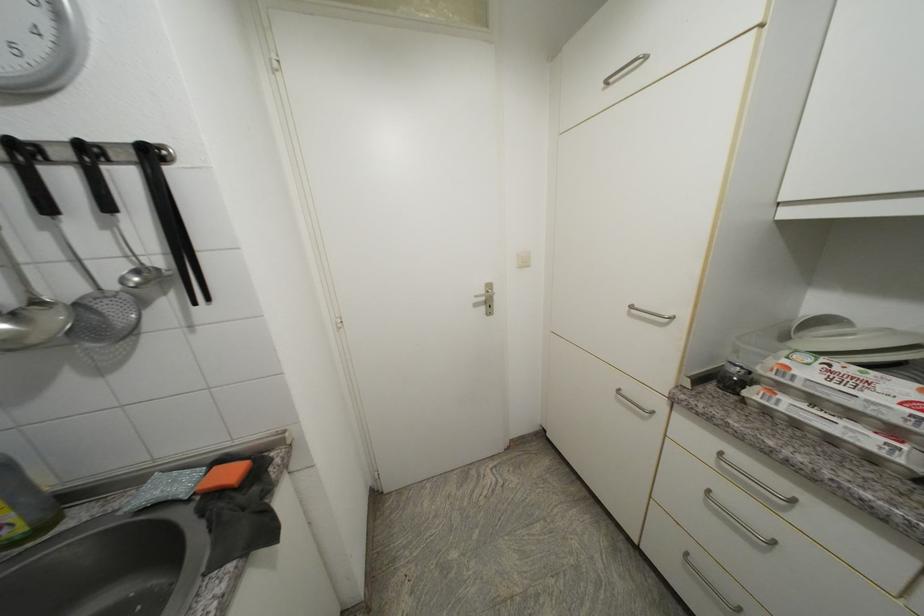
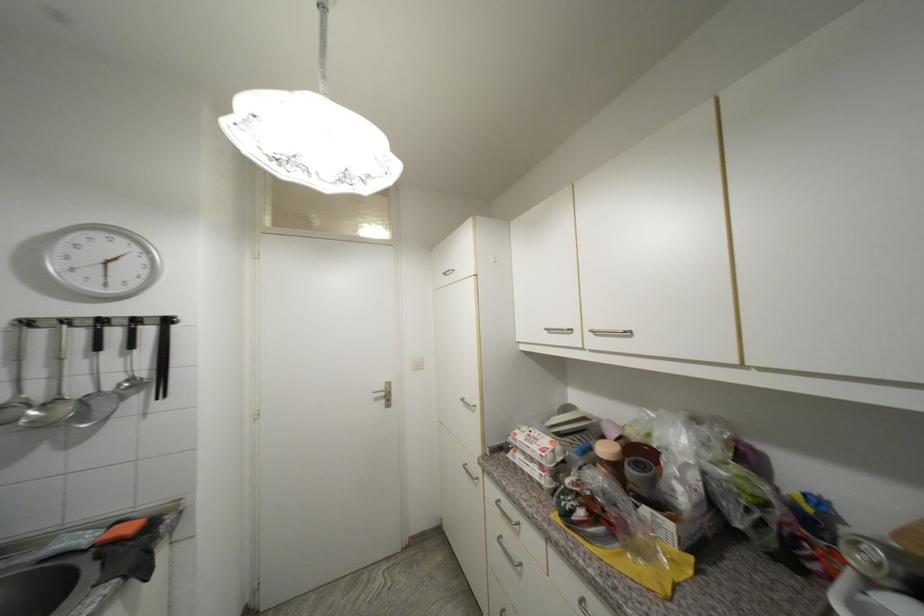
Question: The first image is from the beginning of the video and the second image is from the end. How did the camera likely rotate when shooting the video?

Choices:
 (A) Left
 (B) Right
 (C) Up
 (D) Down

Answer: (C)